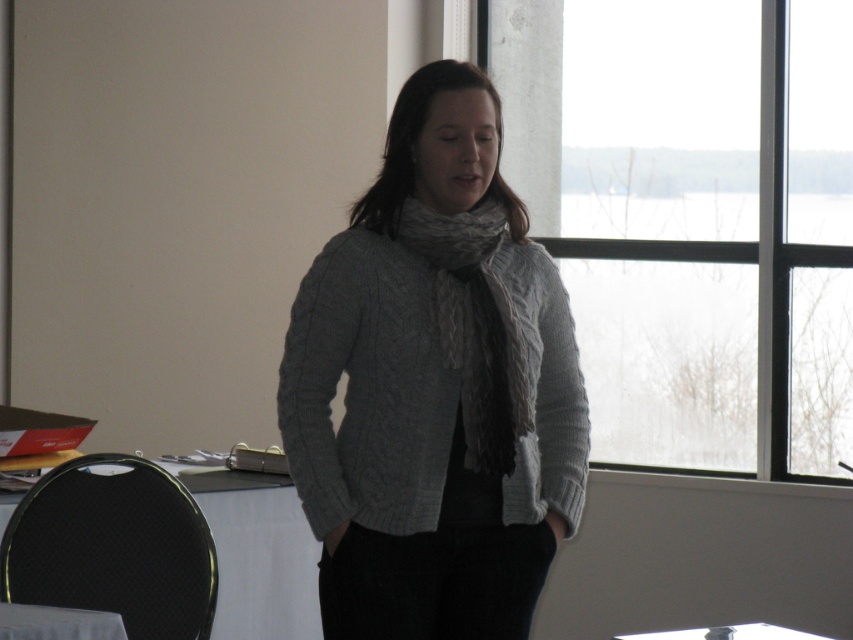
You are organizing a meeting and need to place a 1.2 meter wide conference table in the room. The room has a white fabric table at lower left and a white glossy table at lower left. Which table is wider and can accommodate the conference table?

The white fabric table at lower left is wider than the white glossy table at lower left. However, the conference table is 1.2 meters wide, and there is no information provided about the exact width of the white fabric table at lower left to determine if it can accommodate the conference table.

Consider the image. You are an interior designer planning to place a new rectangular decorative item that is 1 meter wide on the transparent glass window at upper right or the white glossy table at lower left. Based on their sizes, which surface can accommodate the item?

The transparent glass window at upper right has a larger width than the white glossy table at lower left, so the decorative item that is 1 meter wide can be placed on the transparent glass window at upper right if its width is sufficient. However, without knowing the exact width of the window, we cannot confirm. Wait, but the description says the window is wider than the table. If the table is narrower than 1m, then the window might be wider, but if the table is wider than 1m, then both could work. Hmm, the